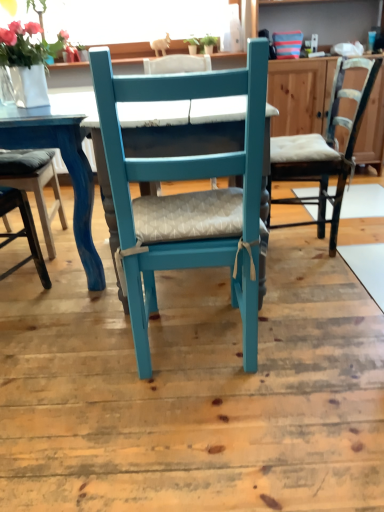
Question: Should I look upward or downward to see matte blue chair at center, the first table when ordered from right to left?

Choices:
 (A) up
 (B) down

Answer: (A)

Question: Considering the relative sizes of matte blue chair at center, the first table when ordered from right to left, and teal painted wood chair at center, the first chair positioned from the left, in the image provided, is matte blue chair at center, the first table when ordered from right to left, thinner than teal painted wood chair at center, the first chair positioned from the left,?

Choices:
 (A) no
 (B) yes

Answer: (A)

Question: From the image's perspective, does matte blue chair at center, which ranks as the 2th table in left-to-right order, appear higher than teal painted wood chair at center, the second chair in the right-to-left sequence?

Choices:
 (A) yes
 (B) no

Answer: (A)

Question: Is matte blue chair at center, which ranks as the 2th table in left-to-right order, further to camera compared to teal painted wood chair at center, the first chair positioned from the left?

Choices:
 (A) no
 (B) yes

Answer: (B)

Question: Is matte blue chair at center, the first table when ordered from right to left, oriented away from teal painted wood chair at center, the first chair positioned from the left?

Choices:
 (A) no
 (B) yes

Answer: (A)

Question: Could you tell me if matte blue chair at center, the first table when ordered from right to left, is turned towards teal painted wood chair at center, the first chair positioned from the left?

Choices:
 (A) no
 (B) yes

Answer: (B)

Question: Can you confirm if matte blue chair at center, which ranks as the 2th table in left-to-right order, is wider than teal painted wood chair at center, the second chair in the right-to-left sequence?

Choices:
 (A) yes
 (B) no

Answer: (A)

Question: Is the surface of teal painted wood chair at center, the 1th chair from the front, in direct contact with matte blue chair at center, the first table when ordered from right to left?

Choices:
 (A) no
 (B) yes

Answer: (A)

Question: Is the position of teal painted wood chair at center, the second chair in the right-to-left sequence, more distant than that of matte blue chair at center, which ranks as the 2th table in left-to-right order?

Choices:
 (A) yes
 (B) no

Answer: (B)

Question: Is teal painted wood chair at center, which is the second chair from back to front, taller than matte blue chair at center, the first table when ordered from right to left?

Choices:
 (A) no
 (B) yes

Answer: (B)

Question: From the image's perspective, is teal painted wood chair at center, the 1th chair from the front, under matte blue chair at center, which ranks as the 2th table in left-to-right order?

Choices:
 (A) yes
 (B) no

Answer: (A)

Question: Is teal painted wood chair at center, which is the second chair from back to front, looking in the opposite direction of matte blue chair at center, which ranks as the 2th table in left-to-right order?

Choices:
 (A) no
 (B) yes

Answer: (A)

Question: Are teal painted wood chair at center, the first chair positioned from the left, and matte blue chair at center, the first table when ordered from right to left, located far from each other?

Choices:
 (A) yes
 (B) no

Answer: (B)

Question: Is matte white vase at upper left facing away from matte blue table at left, the first table viewed from the left?

Choices:
 (A) no
 (B) yes

Answer: (A)